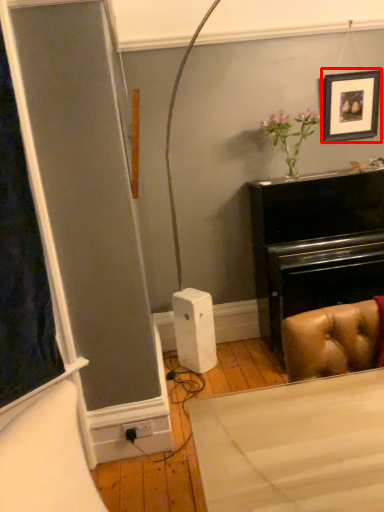
Question: In this image, where is picture frame (annotated by the red box) located relative to plug?

Choices:
 (A) right
 (B) left

Answer: (A)